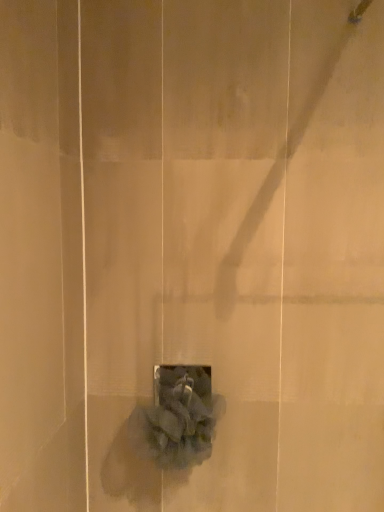
This screenshot has height=512, width=384. What are the coordinates of `dark gray fabric at center` in the screenshot? It's located at (177, 417).

The height and width of the screenshot is (512, 384). What do you see at coordinates (177, 417) in the screenshot? I see `dark gray fabric at center` at bounding box center [177, 417].

At what (x,y) coordinates should I click in order to perform the action: click on dark gray fabric at center. Please return your answer as a coordinate pair (x, y). This screenshot has height=512, width=384. Looking at the image, I should click on (x=177, y=417).